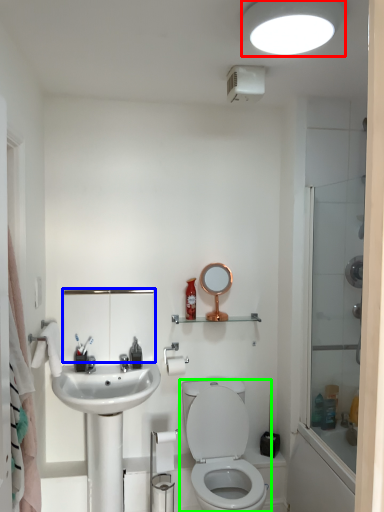
Question: Considering the real-world distances, which object is closest to light fixture (highlighted by a red box)? medicine cabinet (highlighted by a blue box) or toilet (highlighted by a green box).

Choices:
 (A) medicine cabinet
 (B) toilet

Answer: (A)